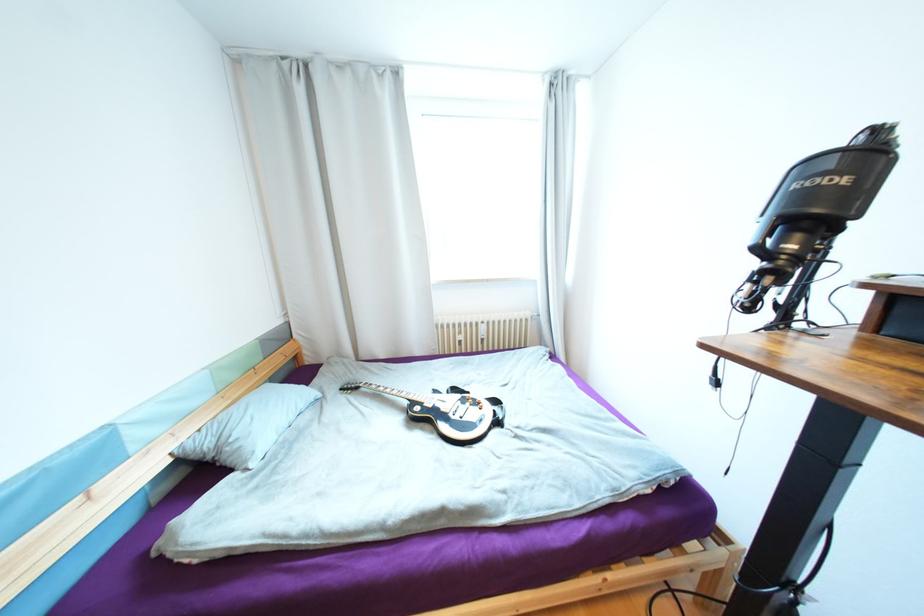
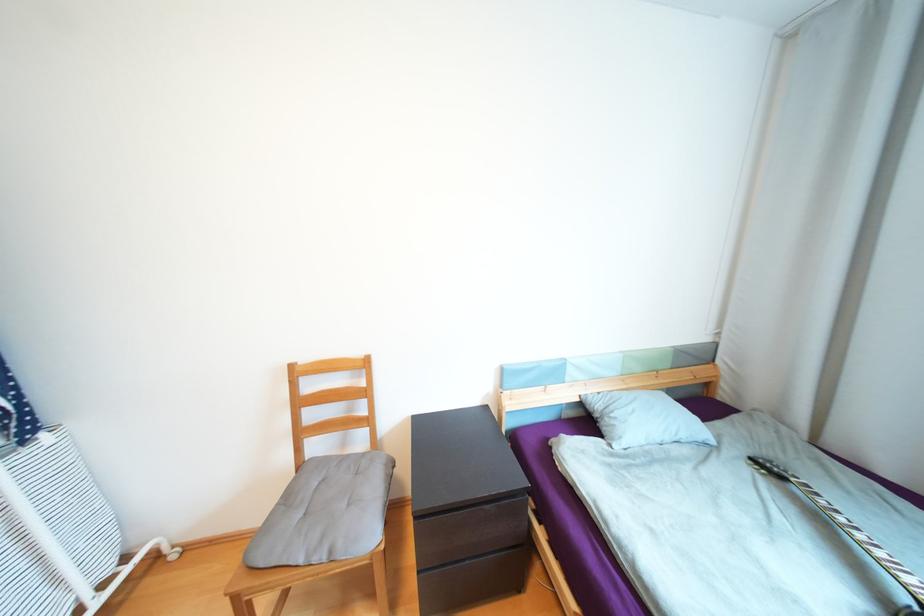
Question: The first image is from the beginning of the video and the second image is from the end. How did the camera likely rotate when shooting the video?

Choices:
 (A) Left
 (B) Right
 (C) Up
 (D) Down

Answer: (A)